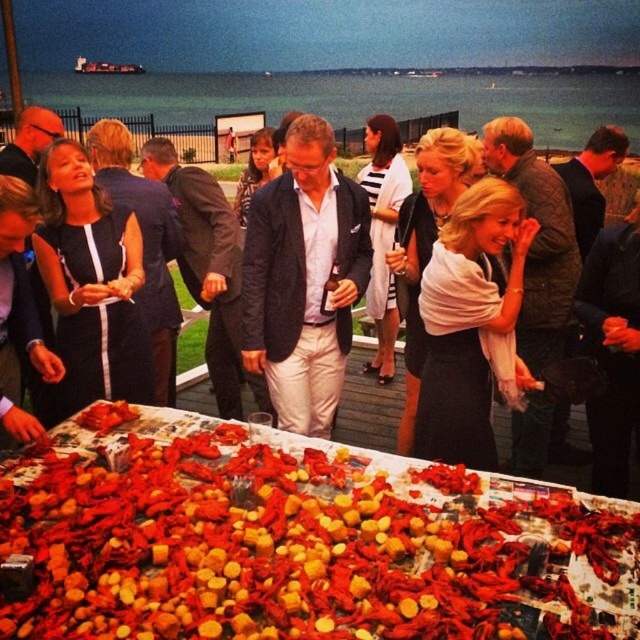
Question: Which object appears closest to the camera in this image?

Choices:
 (A) white matte scarf at center
 (B) shiny red crayfish at center

Answer: (B)

Question: Can you confirm if shiny red crayfish at center is smaller than matte black dress at left?

Choices:
 (A) yes
 (B) no

Answer: (B)

Question: Which point appears farthest from the camera in this image?

Choices:
 (A) (307, 211)
 (B) (104, 317)
 (C) (355, 388)

Answer: (C)

Question: Does shiny red crayfish at center have a larger size compared to matte black blazer at center?

Choices:
 (A) no
 (B) yes

Answer: (B)

Question: Which object is farther from the camera taking this photo?

Choices:
 (A) matte black dress at center
 (B) matte black blazer at center

Answer: (A)

Question: Does shiny red crayfish at center have a lesser width compared to matte black dress at left?

Choices:
 (A) no
 (B) yes

Answer: (A)